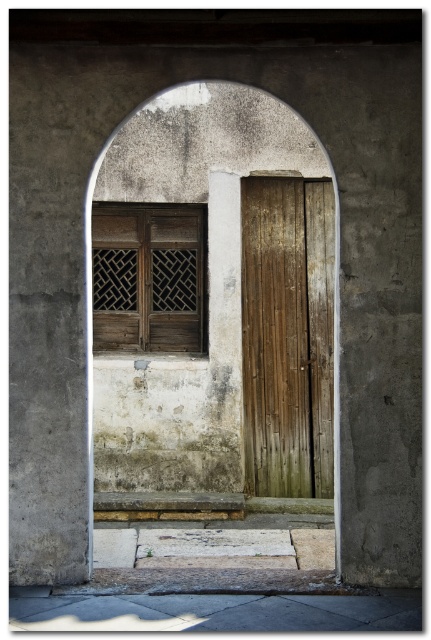
You are an architect designing a new building and want to incorporate elements from this scene. If you need to choose between the wooden lattice at center and the gray concrete at lower center for a structural support beam that requires a thicker material, which one should you choose?

The gray concrete at lower center is thicker than the wooden lattice at center, so you should choose the gray concrete at lower center for the structural support beam.

You are standing in front of the arched doorway and want to move towards the two points marked in the scene. Which point, point (315, 225) or point (190, 625), will you reach first?

Point (315, 225) is closer to you, so you will reach it first.

You are standing in front of the arched doorway. You need to place a small potted plant on the ground near the weathered wood door at center. Where should you place it so that it is on the same level as the gray concrete at lower center?

The weathered wood door at center is located above the gray concrete at lower center, so placing the potted plant on the gray concrete at lower center will ensure it is at the same level as the door.